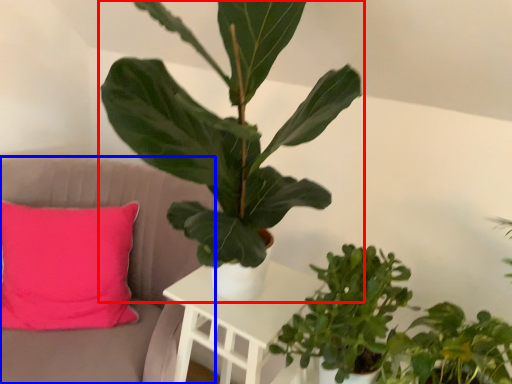
Question: Which point is closer to the camera, houseplant (highlighted by a red box) or armchair (highlighted by a blue box)?

Choices:
 (A) houseplant
 (B) armchair

Answer: (A)